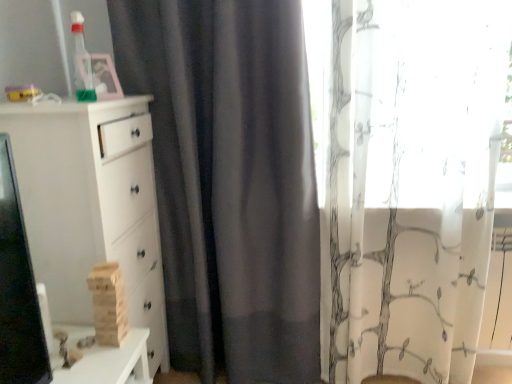
What is the approximate width of transparent plastic bottle at upper left, arranged as the first toy when viewed from the top?

transparent plastic bottle at upper left, arranged as the first toy when viewed from the top, is 3.54 inches wide.

The height and width of the screenshot is (384, 512). I want to click on transparent plastic bottle at upper left, which is the first toy from left to right, so click(82, 62).

Describe the element at coordinates (409, 183) in the screenshot. I see `white sheer curtain at right` at that location.

Measure the distance between point [106,283] and camera.

The distance of point [106,283] from camera is 1.32 meters.

This screenshot has height=384, width=512. I want to click on transparent plastic bottle at upper left, which is the first toy from left to right, so click(x=82, y=62).

From the image's perspective, which is above, white sheer curtain at right or transparent plastic bottle at upper left, arranged as the first toy when viewed from the top?

transparent plastic bottle at upper left, arranged as the first toy when viewed from the top, from the image's perspective.

Is transparent plastic bottle at upper left, which is the first toy from left to right, surrounded by white sheer curtain at right?

No, white sheer curtain at right does not contain transparent plastic bottle at upper left, which is the first toy from left to right.

Is white sheer curtain at right closer to camera compared to transparent plastic bottle at upper left, which is counted as the 2th toy, starting from the bottom?

No, it is behind transparent plastic bottle at upper left, which is counted as the 2th toy, starting from the bottom.

Is wooden blocks at left, which is the 1th toy from bottom to top, closer to camera compared to transparent plastic bottle at upper left, which is the first toy from left to right?

Yes, it is in front of transparent plastic bottle at upper left, which is the first toy from left to right.

Who is taller, wooden blocks at left, which is the first toy from right to left, or transparent plastic bottle at upper left, which is counted as the 2th toy, starting from the bottom?

Standing taller between the two is wooden blocks at left, which is the first toy from right to left.

From the image's perspective, is wooden blocks at left, the 2th toy positioned from the top, on top of transparent plastic bottle at upper left, arranged as the first toy when viewed from the top?

Actually, wooden blocks at left, the 2th toy positioned from the top, appears below transparent plastic bottle at upper left, arranged as the first toy when viewed from the top, in the image.

Which toy is the 1st one when counting from the right side of the white matte chest of drawers at left? Please provide its 2D coordinates.

[(82, 62)]

Which object is positioned more to the right, white matte chest of drawers at left or transparent plastic bottle at upper left, which is counted as the 2th toy, starting from the bottom?

transparent plastic bottle at upper left, which is counted as the 2th toy, starting from the bottom, is more to the right.

Considering the sizes of objects white matte chest of drawers at left and transparent plastic bottle at upper left, which is the first toy from left to right, in the image provided, who is taller, white matte chest of drawers at left or transparent plastic bottle at upper left, which is the first toy from left to right,?

white matte chest of drawers at left is taller.

Which object is positioned more to the left, transparent plastic bottle at upper left, arranged as the first toy when viewed from the top, or wooden blocks at left, which is the first toy from right to left?

Positioned to the left is transparent plastic bottle at upper left, arranged as the first toy when viewed from the top.

Does transparent plastic bottle at upper left, which ranks as the second toy in right-to-left order, have a smaller size compared to wooden blocks at left, which is the second toy in left-to-right order?

Yes, transparent plastic bottle at upper left, which ranks as the second toy in right-to-left order, is smaller than wooden blocks at left, which is the second toy in left-to-right order.

Can you confirm if transparent plastic bottle at upper left, arranged as the first toy when viewed from the top, is taller than wooden blocks at left, which is the second toy in left-to-right order?

In fact, transparent plastic bottle at upper left, arranged as the first toy when viewed from the top, may be shorter than wooden blocks at left, which is the second toy in left-to-right order.

How much distance is there between transparent plastic bottle at upper left, which is counted as the 2th toy, starting from the bottom, and wooden blocks at left, the 2th toy positioned from the top?

transparent plastic bottle at upper left, which is counted as the 2th toy, starting from the bottom, is 28.30 inches from wooden blocks at left, the 2th toy positioned from the top.

From their relative heights in the image, would you say white matte chest of drawers at left is taller or shorter than white sheer curtain at right?

white matte chest of drawers at left is shorter than white sheer curtain at right.

From the image's perspective, is white matte chest of drawers at left beneath white sheer curtain at right?

Yes, from the image's perspective, white matte chest of drawers at left is below white sheer curtain at right.

Is white matte chest of drawers at left wider or thinner than white sheer curtain at right?

white matte chest of drawers at left is wider than white sheer curtain at right.

Which object is closer to the camera taking this photo, white matte chest of drawers at left or white sheer curtain at right?

white matte chest of drawers at left is more forward.

Where is `curtain behind the transparent plastic bottle at upper left, which is counted as the 2th toy, starting from the bottom`? Image resolution: width=512 pixels, height=384 pixels. curtain behind the transparent plastic bottle at upper left, which is counted as the 2th toy, starting from the bottom is located at coordinates coord(409,183).

Considering the positions of point (89, 63) and point (351, 283), is point (89, 63) closer or farther from the camera than point (351, 283)?

Point (89, 63) appears to be closer to the viewer than point (351, 283).

Considering the sizes of objects transparent plastic bottle at upper left, arranged as the first toy when viewed from the top, and white sheer curtain at right in the image provided, who is smaller, transparent plastic bottle at upper left, arranged as the first toy when viewed from the top, or white sheer curtain at right?

transparent plastic bottle at upper left, arranged as the first toy when viewed from the top.

Looking at this image, from the image's perspective, is transparent plastic bottle at upper left, arranged as the first toy when viewed from the top, above or below white sheer curtain at right?

transparent plastic bottle at upper left, arranged as the first toy when viewed from the top, is above white sheer curtain at right.

Is point (93, 307) closer to camera compared to point (66, 295)?

No, it is behind (66, 295).

What's the angular difference between wooden blocks at left, which is the second toy in left-to-right order, and white matte chest of drawers at left's facing directions?

They differ by 78.9 degrees in their facing directions.

Is wooden blocks at left, which is the 1th toy from bottom to top, in front of white matte chest of drawers at left?

No, it is not.

From the image's perspective, which is above, wooden blocks at left, the 2th toy positioned from the top, or white matte chest of drawers at left?

From the image's view, white matte chest of drawers at left is above.

Where is `toy above the white sheer curtain at right (from a real-world perspective)`? toy above the white sheer curtain at right (from a real-world perspective) is located at coordinates (82, 62).

Locate an element on the screen. Image resolution: width=512 pixels, height=384 pixels. toy behind the wooden blocks at left, which is the second toy in left-to-right order is located at coordinates (82, 62).

From the picture: Looking at the image, which one is located further to white matte chest of drawers at left, white sheer curtain at right or wooden blocks at left, which is the 1th toy from bottom to top?

white sheer curtain at right is further to white matte chest of drawers at left.

When comparing their distances from transparent plastic bottle at upper left, arranged as the first toy when viewed from the top, does white sheer curtain at right or white matte chest of drawers at left seem further?

white sheer curtain at right lies further to transparent plastic bottle at upper left, arranged as the first toy when viewed from the top, than the other object.

When comparing their distances from white matte chest of drawers at left, does wooden blocks at left, the 2th toy positioned from the top, or white sheer curtain at right seem further?

white sheer curtain at right.

When comparing their distances from wooden blocks at left, which is the first toy from right to left, does transparent plastic bottle at upper left, which ranks as the second toy in right-to-left order, or white sheer curtain at right seem further?

white sheer curtain at right is further to wooden blocks at left, which is the first toy from right to left.

From the image, which object appears to be farther from white matte chest of drawers at left, transparent plastic bottle at upper left, which is counted as the 2th toy, starting from the bottom, or white sheer curtain at right?

Based on the image, white sheer curtain at right appears to be further to white matte chest of drawers at left.

Which object lies further to the anchor point white matte chest of drawers at left, wooden blocks at left, which is the second toy in left-to-right order, or transparent plastic bottle at upper left, which is counted as the 2th toy, starting from the bottom?

Based on the image, transparent plastic bottle at upper left, which is counted as the 2th toy, starting from the bottom, appears to be further to white matte chest of drawers at left.

Estimate the real-world distances between objects in this image. Which object is closer to white sheer curtain at right, transparent plastic bottle at upper left, which ranks as the second toy in right-to-left order, or wooden blocks at left, which is the first toy from right to left?

wooden blocks at left, which is the first toy from right to left, is closer to white sheer curtain at right.

From the image, which object appears to be nearer to white sheer curtain at right, transparent plastic bottle at upper left, which is counted as the 2th toy, starting from the bottom, or white matte chest of drawers at left?

white matte chest of drawers at left lies closer to white sheer curtain at right than the other object.

Image resolution: width=512 pixels, height=384 pixels. I want to click on chest of drawers between transparent plastic bottle at upper left, which is the first toy from left to right, and wooden blocks at left, which is the 1th toy from bottom to top, from top to bottom, so click(x=91, y=206).

Where is `toy between transparent plastic bottle at upper left, which is the first toy from left to right, and white sheer curtain at right from left to right`? Image resolution: width=512 pixels, height=384 pixels. toy between transparent plastic bottle at upper left, which is the first toy from left to right, and white sheer curtain at right from left to right is located at coordinates (108, 304).